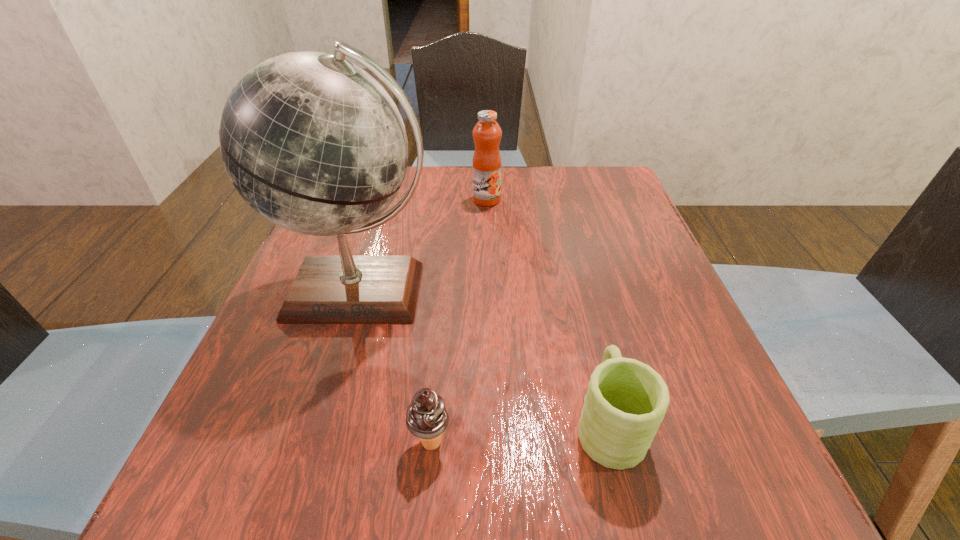
Identify the location of free space between the icecream and the rightmost object. (519, 433).

Locate an element on the screen. This screenshot has height=540, width=960. vacant area that lies between the second object from right to left and the tallest object is located at coordinates (423, 246).

I want to click on free space between the second farthest object and the fruit juice, so click(x=423, y=246).

The image size is (960, 540). In order to click on vacant area that lies between the icecream and the farthest object in this screenshot , I will do `click(459, 321)`.

The image size is (960, 540). What are the coordinates of `the closest object to the farthest object` in the screenshot? It's located at click(314, 144).

Locate which object is the second closest to the rightmost object. Please provide its 2D coordinates. Your answer should be formatted as a tuple, i.e. [(x, y)], where the tuple contains the x and y coordinates of a point satisfying the conditions above.

[(314, 144)]

Image resolution: width=960 pixels, height=540 pixels. What are the coordinates of `vacant area that satisfies the following two spatial constraints: 1. at the equator of the icecream; 2. on the right side of the tallest object` in the screenshot? It's located at (316, 442).

Where is `vacant space that satisfies the following two spatial constraints: 1. at the equator of the icecream; 2. on the right side of the third nearest object`? The image size is (960, 540). vacant space that satisfies the following two spatial constraints: 1. at the equator of the icecream; 2. on the right side of the third nearest object is located at coordinates (316, 442).

Image resolution: width=960 pixels, height=540 pixels. I want to click on free space that satisfies the following two spatial constraints: 1. at the equator of the icecream; 2. on the right side of the globe, so click(316, 442).